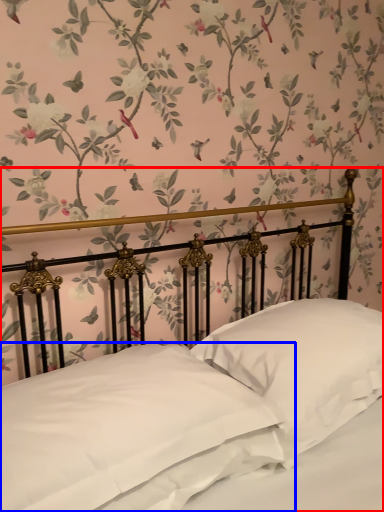
Question: Which point is closer to the camera, bed (highlighted by a red box) or pillow (highlighted by a blue box)?

Choices:
 (A) bed
 (B) pillow

Answer: (A)